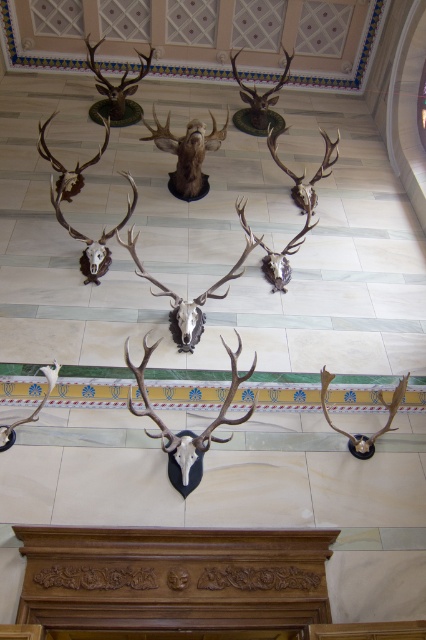
Question: Which of the following is the closest to the observer?

Choices:
 (A) white matte skull at center
 (B) silver metallic antlers at lower left
 (C) matte silver antlers at center
 (D) brown polished deer skull at upper left

Answer: (B)

Question: Based on their relative distances, which object is farther from the shiny brown antlers at lower right?

Choices:
 (A) shiny silver antlers at center
 (B) shiny brown antlers at center

Answer: (A)

Question: Does shiny silver skull at center have a smaller size compared to shiny brown antlers at lower right?

Choices:
 (A) no
 (B) yes

Answer: (A)

Question: Can you confirm if white matte skull at center is bigger than silver metallic antlers at lower left?

Choices:
 (A) yes
 (B) no

Answer: (A)

Question: Which point is farther from the camera taking this photo?

Choices:
 (A) (195, 161)
 (B) (331, 380)
 (C) (244, 413)

Answer: (A)

Question: Does brown matte deer head at center have a smaller size compared to white matte skull at center?

Choices:
 (A) no
 (B) yes

Answer: (A)